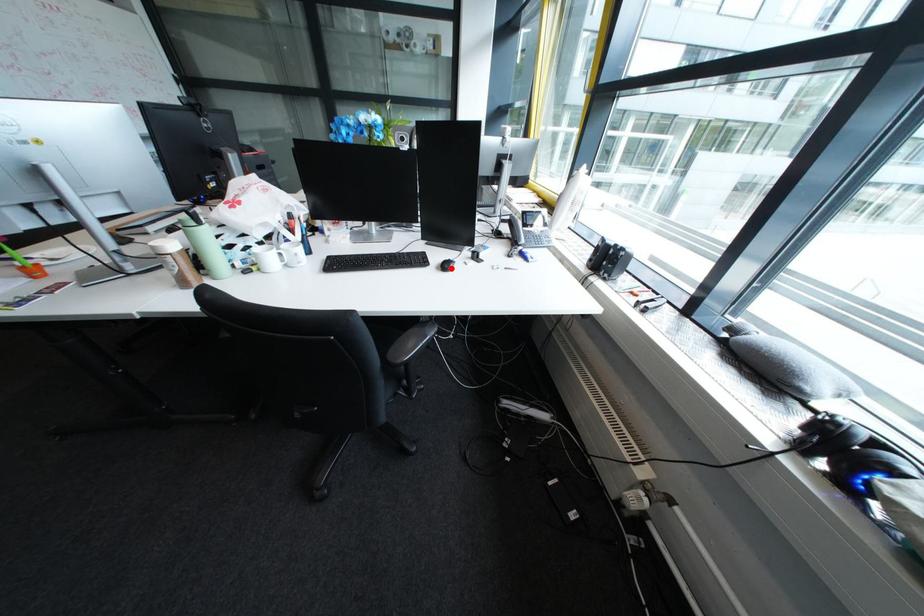
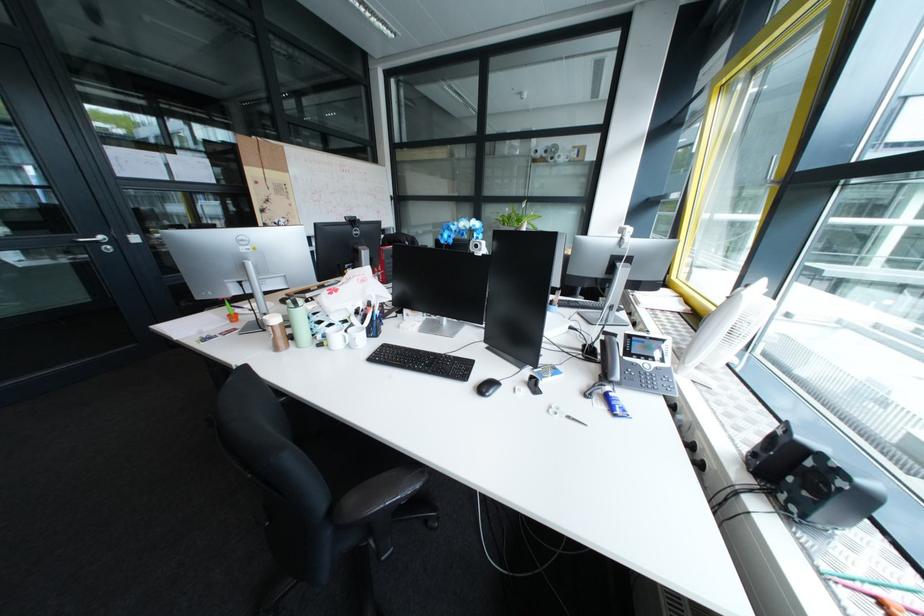
Find the pixel in the second image that matches the highlighted location in the first image.

(488, 387)